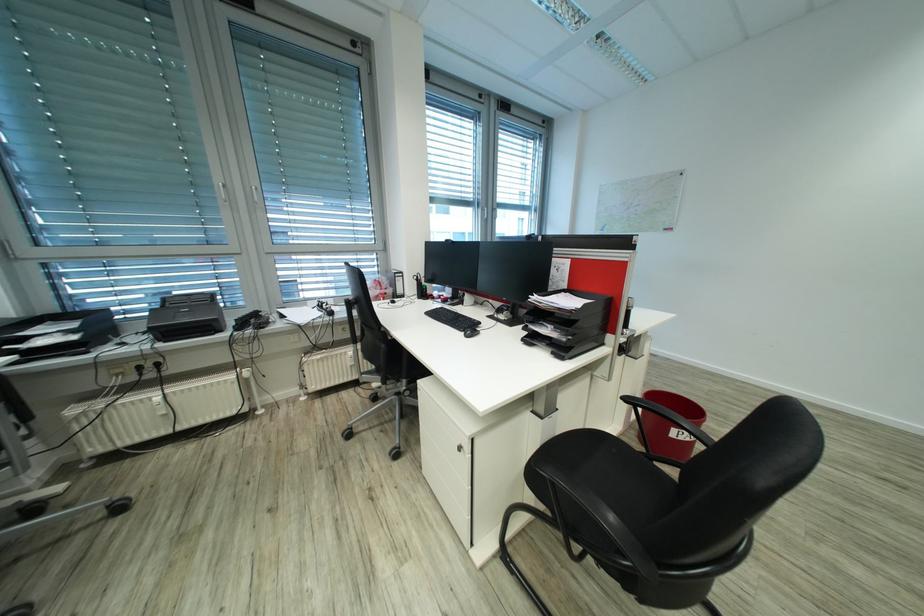
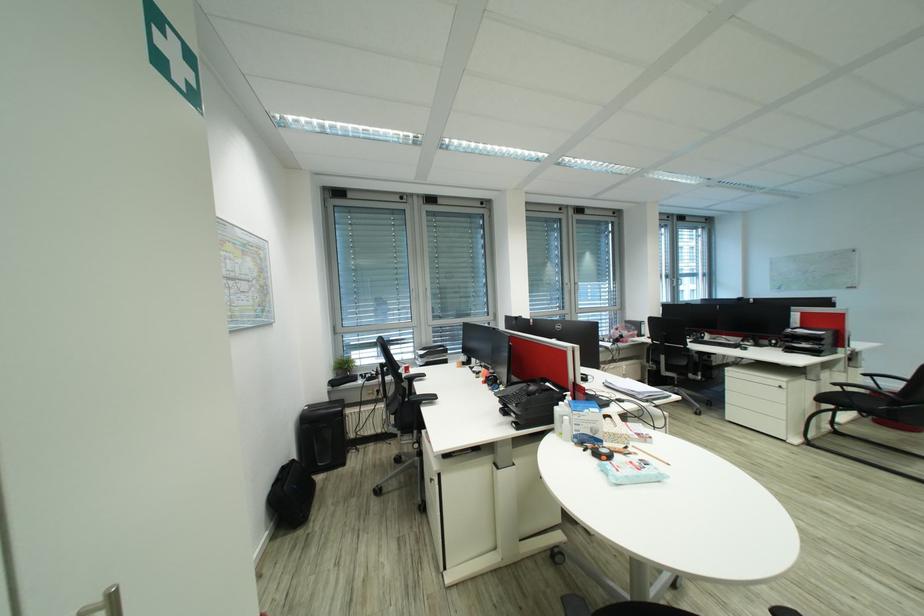
The images are taken continuously from a first-person perspective. In which direction are you moving?

The movement direction of the cameraman is left, backward.